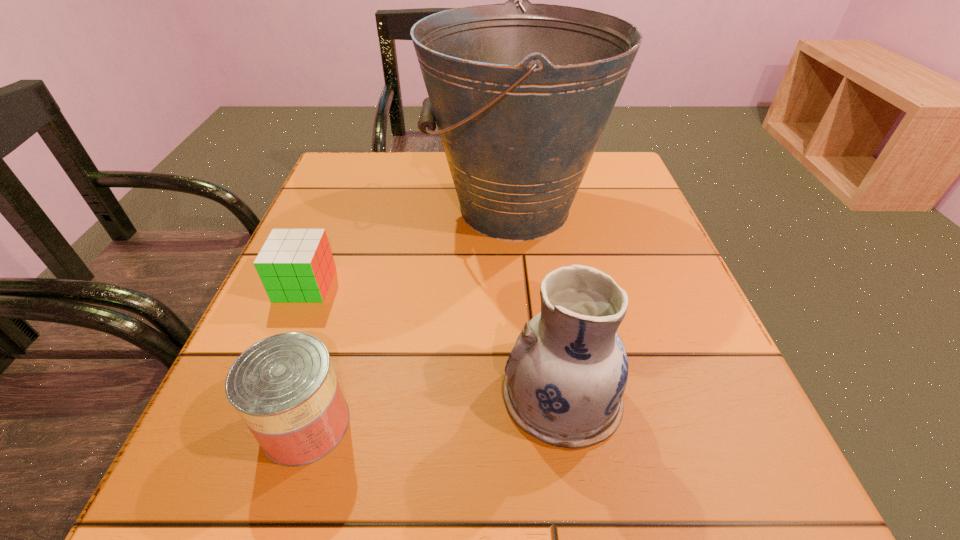
Find the location of a particular element. blank space located 0.260m on the back of the third tallest object is located at coordinates (353, 271).

Identify the location of vacant space situated 0.120m on the back of the third nearest object. (327, 231).

Find the location of a particular element. The height and width of the screenshot is (540, 960). object that is positioned at the far edge is located at coordinates (521, 94).

Locate an element on the screen. The image size is (960, 540). pottery located in the near edge section of the desktop is located at coordinates (x=565, y=378).

Where is `can that is at the near edge`? can that is at the near edge is located at coordinates (284, 387).

Identify the location of can present at the left edge. This screenshot has width=960, height=540. (284, 387).

Where is `cube that is at the left edge`? cube that is at the left edge is located at coordinates (295, 265).

The width and height of the screenshot is (960, 540). In order to click on object located at the right edge in this screenshot , I will do `click(521, 94)`.

This screenshot has height=540, width=960. I want to click on object situated at the near left corner, so (284, 387).

Where is `object present at the far right corner`? object present at the far right corner is located at coordinates (521, 94).